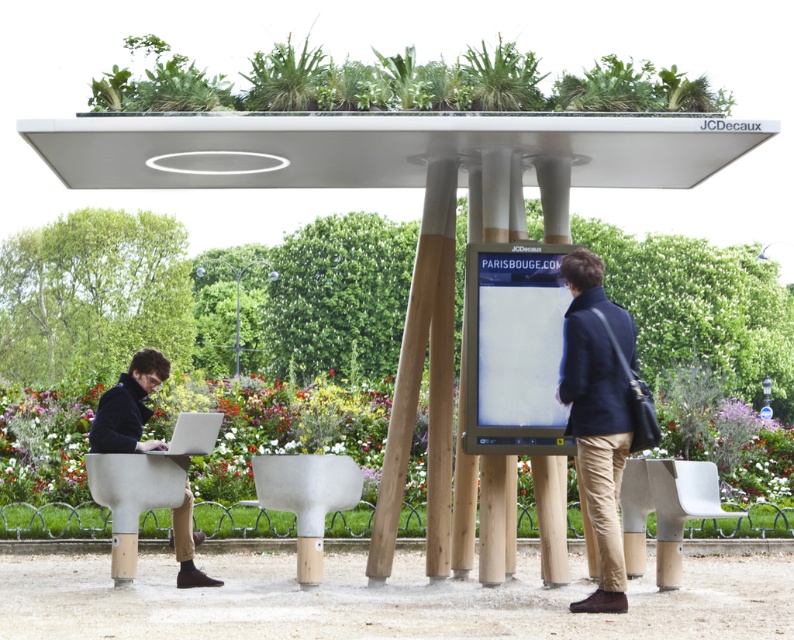
Does white wood table at center come in front of matte gray chair at lower left?

Yes, white wood table at center is in front of matte gray chair at lower left.

Find the location of `white wood table at center`. white wood table at center is located at coordinates (307, 499).

Find the location of a particular element. This screenshot has height=640, width=794. white wood table at center is located at coordinates (x=307, y=499).

From the picture: Does green leafy plant at center have a lesser width compared to white wood table at center?

No.

Can you confirm if green leafy plant at center is shorter than white wood table at center?

Incorrect, green leafy plant at center's height does not fall short of white wood table at center's.

What are the coordinates of `green leafy plant at center` in the screenshot? It's located at (274, 426).

Who is more forward, (611, 394) or (660, 486)?

Positioned in front is point (611, 394).

Which is behind, point (604, 449) or point (658, 467)?

The point (658, 467) is more distant.

Which is behind, point (600, 296) or point (654, 488)?

The point (654, 488) is behind.

This screenshot has width=794, height=640. I want to click on dark blue jacket at center, so coord(596,416).